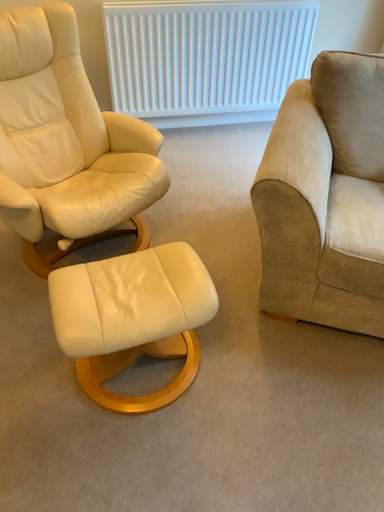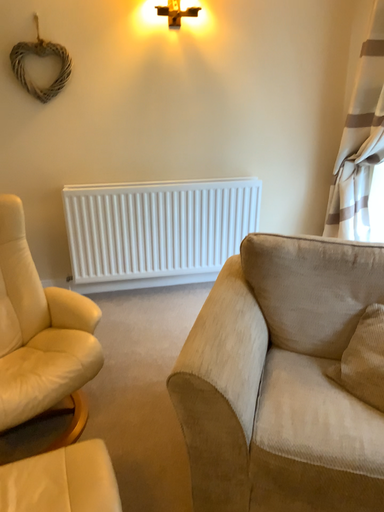
Question: How did the camera likely rotate when shooting the video?

Choices:
 (A) rotated upward
 (B) rotated downward

Answer: (A)